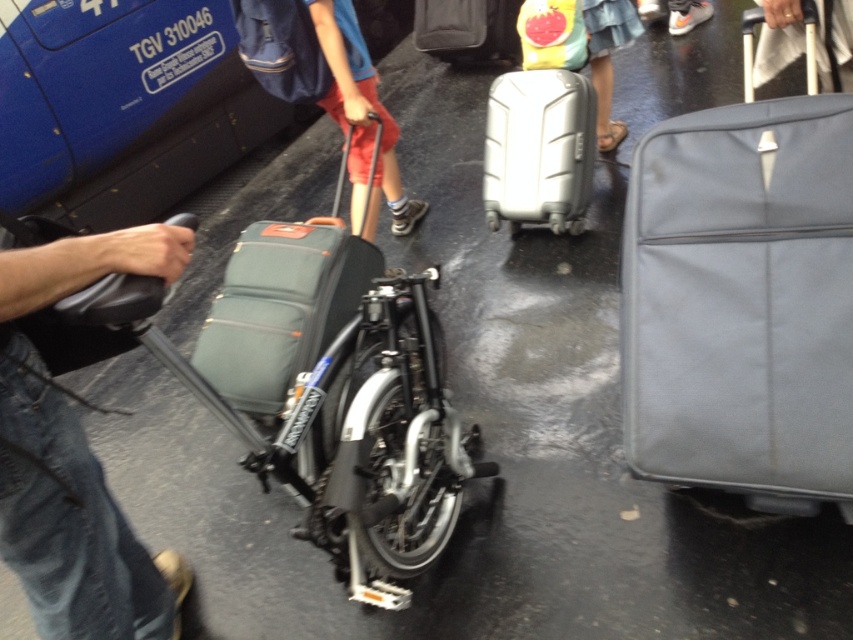
You are at the train station and need to retrieve your luggage. You see a matte red suitcase at center and a denim skirt at center. Which item is located to the left of the other?

The matte red suitcase at center is positioned on the left side of denim skirt at center.

You are standing at the train station platform and want to know which of the two points, point (328, 104) or point (602, 140), is closer to you. Based on the image, which one is nearer?

Point (328, 104) is closer to the camera than point (602, 140), so it is the nearer one.

You are a traveler at the train station who needs to retrieve your matte gray suitcase at right. However, there is a matte blue backpack at center in the way. Can you easily access your suitcase without moving the backpack?

The matte gray suitcase at right is positioned under the matte blue backpack at center, so you can easily access it without moving the backpack since it is underneath.